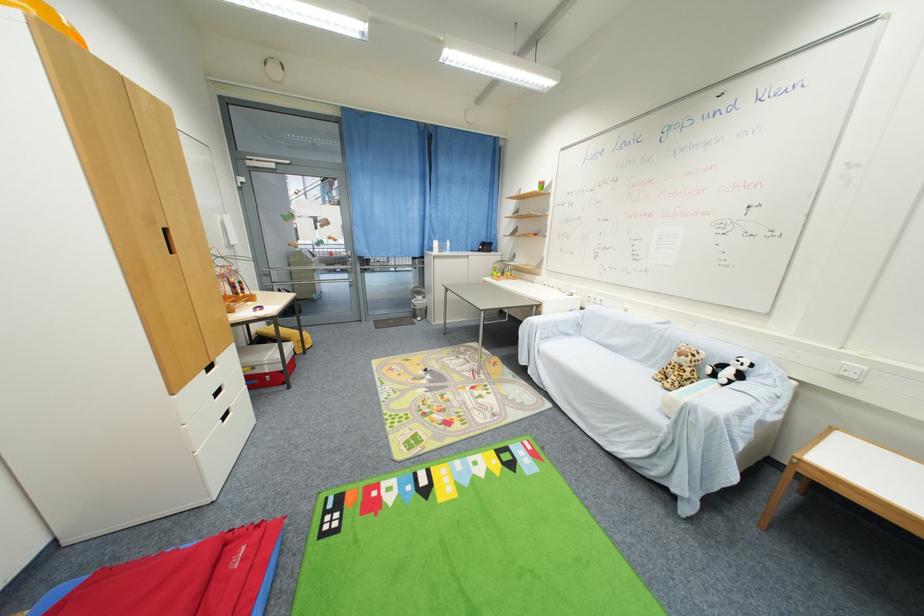
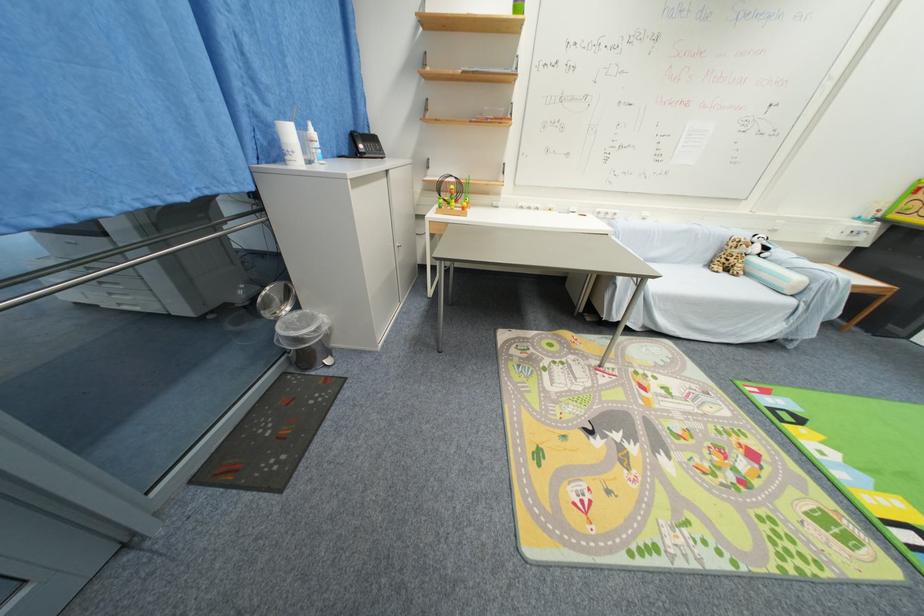
In the second image, find the point that corresponds to pixel 727 368 in the first image.

(754, 246)